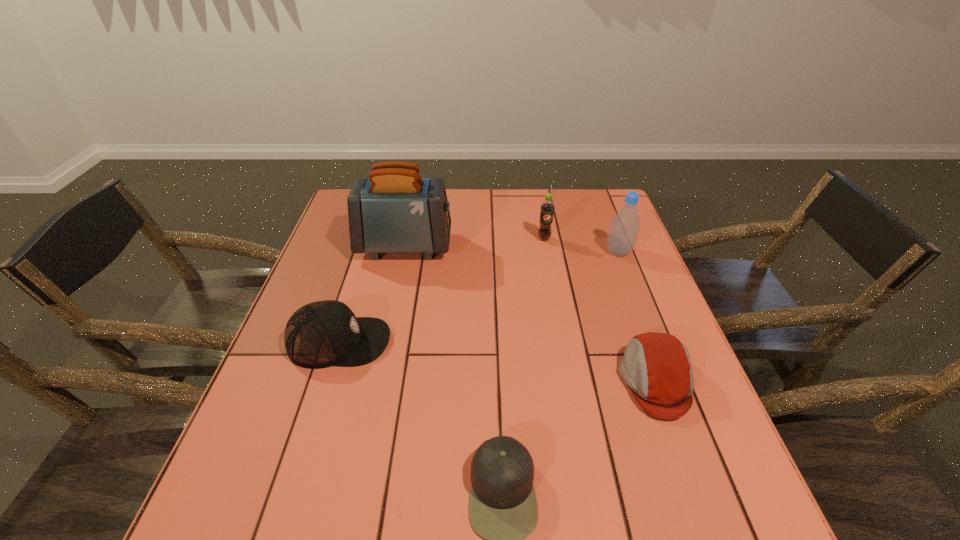
Locate an element on the screen. vacant space positioned 0.230m on the front-facing side of the fourth tallest object is located at coordinates (490, 342).

Where is `free space located 0.090m on the front-facing side of the rightmost cap`? The width and height of the screenshot is (960, 540). free space located 0.090m on the front-facing side of the rightmost cap is located at coordinates (578, 381).

Find the location of a particular element. free spot located 0.230m on the front-facing side of the rightmost cap is located at coordinates (513, 381).

This screenshot has height=540, width=960. Identify the location of vacant space situated on the front-facing side of the rightmost cap. [456, 381].

At what (x,y) coordinates should I click in order to perform the action: click on toaster that is at the left edge. Please return your answer as a coordinate pair (x, y). The width and height of the screenshot is (960, 540). Looking at the image, I should click on (395, 210).

Where is `cap that is at the left edge`? cap that is at the left edge is located at coordinates pyautogui.click(x=320, y=334).

Locate an element on the screen. This screenshot has height=540, width=960. bottle at the right edge is located at coordinates (625, 225).

Identify the location of cap at the right edge. The image size is (960, 540). (656, 367).

I want to click on free point at the far edge, so click(473, 218).

Find the location of a particular element. This screenshot has width=960, height=540. vacant space at the near edge of the desktop is located at coordinates pos(599,539).